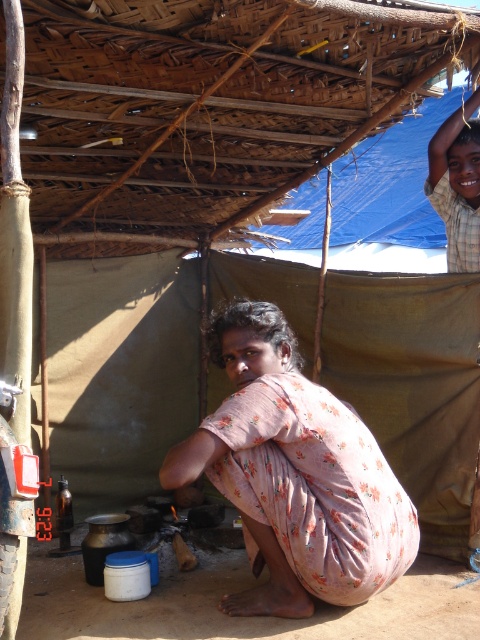
You are standing at the entrance of the shelter and want to place a new item on the bamboo mat at upper center. According to the coordinates provided, where exactly should you position the item?

The bamboo mat at upper center is located at point coordinates (212, 104), so you should position the item at those coordinates to place it on the bamboo mat at upper center.

From the picture: You are a visitor at this rustic outdoor shelter and notice the bamboo mat at upper center and the light brown wooden headband at upper right. Which object is positioned higher from the ground?

The bamboo mat at upper center is located above the light brown wooden headband at upper right, so it is positioned higher from the ground.

You are standing at the entrance of the shelter and want to place a new item between the bamboo mat at upper center and the floral cotton dress at center. Based on their positions, which object should be on the left side when placing the new item?

The bamboo mat at upper center is to the left of the floral cotton dress at center, so when placing the new item between them, the bamboo mat at upper center should be on the left side.